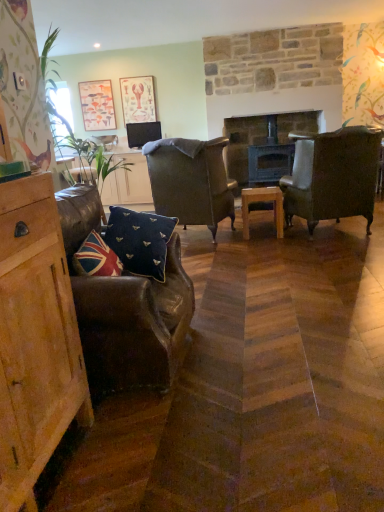
Question: From a real-world perspective, is wooden table at center physically below green leafy plant at left?

Choices:
 (A) yes
 (B) no

Answer: (A)

Question: Is wooden table at center wider than green leafy plant at left?

Choices:
 (A) no
 (B) yes

Answer: (A)

Question: Does wooden table at center touch green leafy plant at left?

Choices:
 (A) no
 (B) yes

Answer: (A)

Question: Considering the relative positions of wooden table at center and green leafy plant at left in the image provided, is wooden table at center to the left of green leafy plant at left from the viewer's perspective?

Choices:
 (A) yes
 (B) no

Answer: (B)

Question: Is wooden table at center oriented towards green leafy plant at left?

Choices:
 (A) no
 (B) yes

Answer: (A)

Question: From the image's perspective, is navy velvet cushion at center, the second pillow when ordered from front to back, above or below matte black tv at center?

Choices:
 (A) above
 (B) below

Answer: (B)

Question: From a real-world perspective, is navy velvet cushion at center, which is counted as the 1th pillow, starting from the back, positioned above or below matte black tv at center?

Choices:
 (A) below
 (B) above

Answer: (A)

Question: From their relative heights in the image, would you say navy velvet cushion at center, the second pillow when ordered from front to back, is taller or shorter than matte black tv at center?

Choices:
 (A) tall
 (B) short

Answer: (A)

Question: In the image, is navy velvet cushion at center, which is counted as the 1th pillow, starting from the back, positioned in front of or behind matte black tv at center?

Choices:
 (A) front
 (B) behind

Answer: (A)

Question: From the image's perspective, is matte paper picture frame at upper center, acting as the 1th picture frame starting from the right, above or below green leafy plant at left?

Choices:
 (A) below
 (B) above

Answer: (B)

Question: In the image, is matte paper picture frame at upper center, acting as the 1th picture frame starting from the right, positioned in front of or behind green leafy plant at left?

Choices:
 (A) behind
 (B) front

Answer: (A)

Question: In terms of width, does matte paper picture frame at upper center, acting as the 1th picture frame starting from the right, look wider or thinner when compared to green leafy plant at left?

Choices:
 (A) wide
 (B) thin

Answer: (B)

Question: Is point (139, 97) closer or farther from the camera than point (46, 74)?

Choices:
 (A) closer
 (B) farther

Answer: (B)

Question: From the image's perspective, relative to green leafy plant at left, is leather wingback chair at center, which is counted as the second chair, starting from the left, above or below?

Choices:
 (A) below
 (B) above

Answer: (A)

Question: Visually, is leather wingback chair at center, the 1th chair viewed from the back, positioned to the left or to the right of green leafy plant at left?

Choices:
 (A) left
 (B) right

Answer: (B)